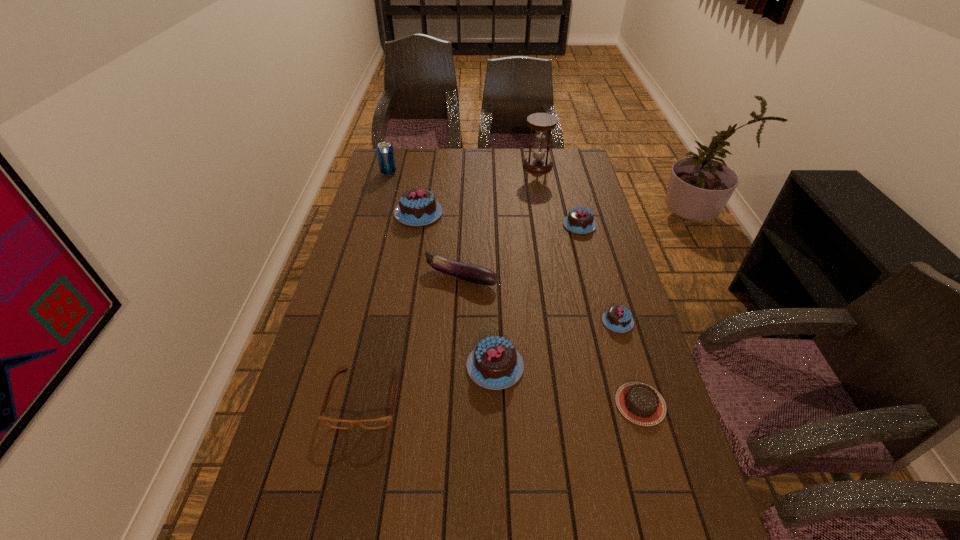
Locate an element on the screen. Image resolution: width=960 pixels, height=540 pixels. free space that satisfies the following two spatial constraints: 1. on the front side of the third tallest object; 2. on the left side of the brown chocolate cake is located at coordinates (387, 404).

Where is `free space that satisfies the following two spatial constraints: 1. on the front side of the beer can; 2. on the left side of the fourth nearest object`? The height and width of the screenshot is (540, 960). free space that satisfies the following two spatial constraints: 1. on the front side of the beer can; 2. on the left side of the fourth nearest object is located at coordinates (347, 321).